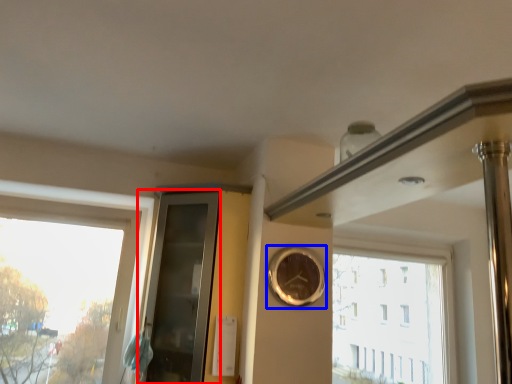
Question: Which point is further to the camera, glass door (highlighted by a red box) or clock (highlighted by a blue box)?

Choices:
 (A) glass door
 (B) clock

Answer: (B)